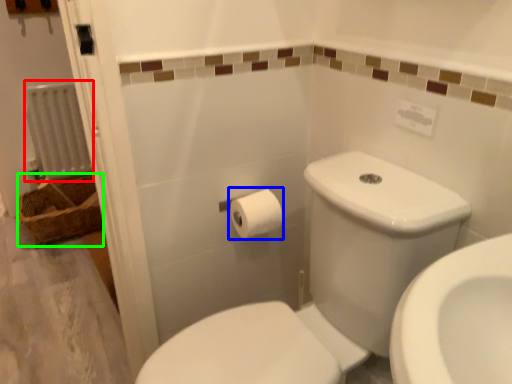
Question: Which is farther away from radiator (highlighted by a red box)? toilet paper (highlighted by a blue box) or basket (highlighted by a green box)?

Choices:
 (A) toilet paper
 (B) basket

Answer: (A)